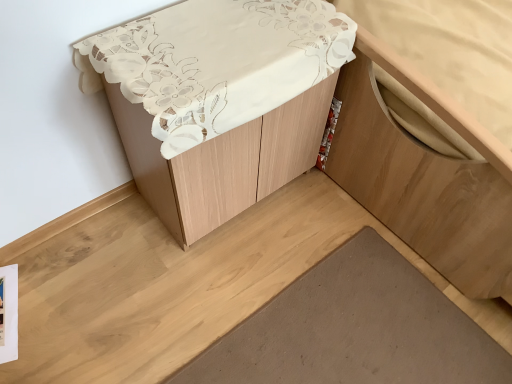
Identify the location of vacant space situated above brown matte wood plank at lower center (from a real-world perspective). The width and height of the screenshot is (512, 384). (364, 349).